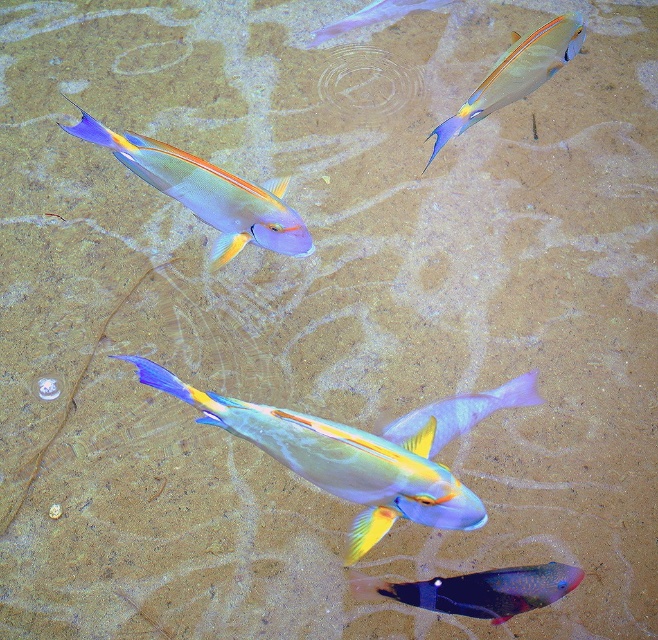
Question: Which object is closer to the camera taking this photo?

Choices:
 (A) translucent purple fish at center
 (B) matte blue fish at upper left

Answer: (A)

Question: Is shiny metallic fish at upper right bigger than translucent purple fish at upper center?

Choices:
 (A) no
 (B) yes

Answer: (A)

Question: Does translucent purple fish at center appear on the left side of translucent purple fish at upper center?

Choices:
 (A) no
 (B) yes

Answer: (A)

Question: From the image, what is the correct spatial relationship of translucent purple fish at center in relation to translucent purple fish at upper center?

Choices:
 (A) right
 (B) left

Answer: (A)

Question: Which of the following is the farthest from the observer?

Choices:
 (A) shiny metallic fish at center
 (B) translucent blue fish at lower center

Answer: (B)

Question: Estimate the real-world distances between objects in this image. Which object is farther from the translucent blue fish at lower center?

Choices:
 (A) translucent purple fish at center
 (B) shiny metallic fish at center

Answer: (A)